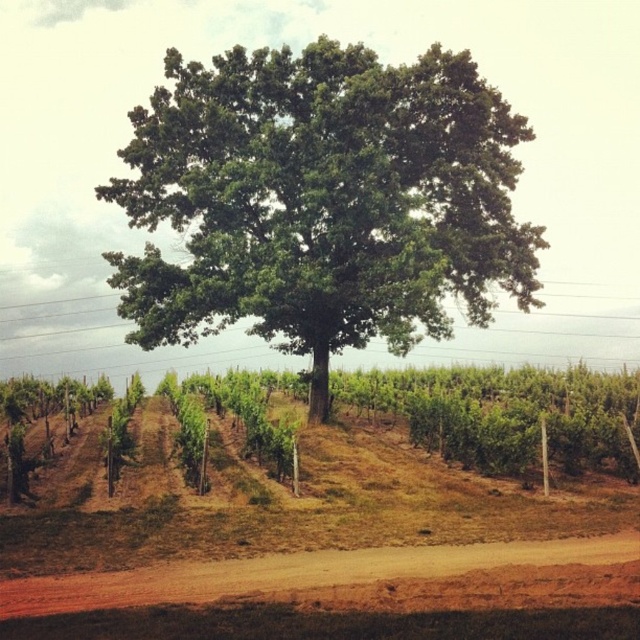
You are standing in the middle of a vineyard and see the green leafy oak at center. If you want to walk directly towards the oak, which direction should you head?

The green leafy oak at center is located at point (323,200) in the image. Since you are in the middle of the vineyard, you should walk towards the center of the image to reach the oak.

You are a gardener planning to plant a new row of grapevines between the green leafy oak at center and the brown dirt track at lower center. Which object has a greater width to allow more space for the new row?

The green leafy oak at center has a greater width than the brown dirt track at lower center, so planting the new row of grapevines next to the green leafy oak at center would provide more space.